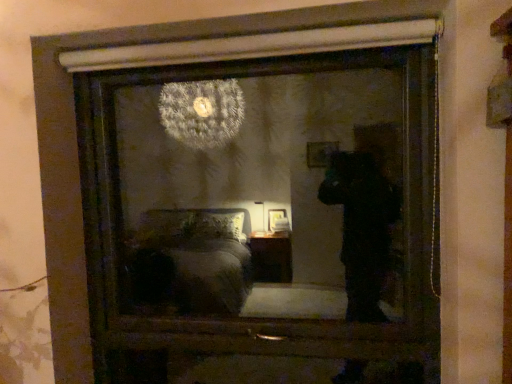
The image size is (512, 384). Describe the element at coordinates (257, 190) in the screenshot. I see `wooden mirror at center` at that location.

Identify the location of wooden mirror at center. [257, 190].

This screenshot has height=384, width=512. In order to click on wooden mirror at center in this screenshot , I will do `click(257, 190)`.